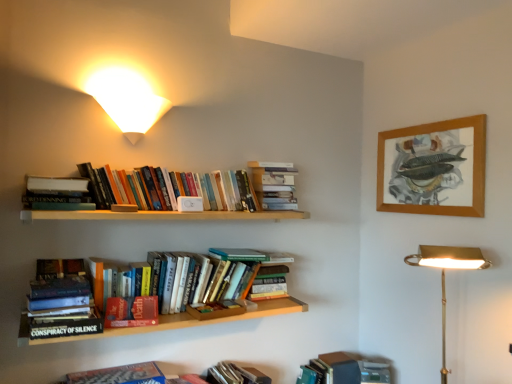
Find the location of a particular element. Image resolution: width=512 pixels, height=384 pixels. hardcover book at lower left, the fourth book when ordered from top to bottom is located at coordinates (62, 301).

Where is `wooden picture frame at upper right`? wooden picture frame at upper right is located at coordinates (434, 168).

Find the location of `hardcover book at lower right, placed as the 1th book when sorted from bottom to top`. hardcover book at lower right, placed as the 1th book when sorted from bottom to top is located at coordinates (343, 370).

Describe the element at coordinates (343, 370) in the screenshot. This screenshot has height=384, width=512. I see `hardcover book at lower right, the seventh book viewed from the top` at that location.

What are the coordinates of `hardcover book at lower left, the fourth book when ordered from top to bottom` in the screenshot? It's located at (62, 301).

How many degrees apart are the facing directions of hardcover book at center, the 6th book in the top-to-bottom sequence, and hardcover books at upper center, which is counted as the 6th book, starting from the bottom?

2.92 degrees separate the facing orientations of hardcover book at center, the 6th book in the top-to-bottom sequence, and hardcover books at upper center, which is counted as the 6th book, starting from the bottom.

Is hardcover book at center, the 6th book in the top-to-bottom sequence, at the left side of hardcover books at upper center, the second book in the top-to-bottom sequence?

Yes, hardcover book at center, the 6th book in the top-to-bottom sequence, is to the left of hardcover books at upper center, the second book in the top-to-bottom sequence.

Is hardcover book at center, the 6th book in the top-to-bottom sequence, thinner than hardcover books at upper center, which is counted as the 6th book, starting from the bottom?

No.

From the image's perspective, between hardcover book at center, which ranks as the second book in bottom-to-top order, and hardcover books at upper center, which is counted as the 6th book, starting from the bottom, who is located below?

hardcover book at center, which ranks as the second book in bottom-to-top order.

Who is taller, hardcover books at upper center, which is counted as the 6th book, starting from the bottom, or hardcover book at lower left, the fourth book when ordered from top to bottom?

Standing taller between the two is hardcover book at lower left, the fourth book when ordered from top to bottom.

Which object is thinner, hardcover books at upper center, which is counted as the 6th book, starting from the bottom, or hardcover book at lower left, positioned as the fourth book in bottom-to-top order?

With smaller width is hardcover books at upper center, which is counted as the 6th book, starting from the bottom.

Is hardcover books at upper center, which is counted as the 6th book, starting from the bottom, to the left or to the right of hardcover book at lower left, the fourth book when ordered from top to bottom, in the image?

hardcover books at upper center, which is counted as the 6th book, starting from the bottom, is positioned on hardcover book at lower left, the fourth book when ordered from top to bottom,'s right side.

The image size is (512, 384). I want to click on lamp above the gold brass desk lamp at lower right, the second lamp when ordered from top to bottom (from a real-world perspective), so click(x=126, y=99).

In the image, is gold brass desk lamp at lower right, the second lamp when ordered from top to bottom, positioned in front of or behind white matte wall sconce at upper left, the 1th lamp when ordered from left to right?

gold brass desk lamp at lower right, the second lamp when ordered from top to bottom, is in front of white matte wall sconce at upper left, the 1th lamp when ordered from left to right.

Considering the sizes of objects gold brass desk lamp at lower right, the second lamp when ordered from top to bottom, and white matte wall sconce at upper left, acting as the second lamp starting from the right, in the image provided, who is thinner, gold brass desk lamp at lower right, the second lamp when ordered from top to bottom, or white matte wall sconce at upper left, acting as the second lamp starting from the right,?

white matte wall sconce at upper left, acting as the second lamp starting from the right, is thinner.

Considering the relative sizes of hardcover book at upper left, the 5th book ordered from the bottom, and white matte wall sconce at upper left, which is the 1th lamp in top-to-bottom order, in the image provided, is hardcover book at upper left, the 5th book ordered from the bottom, smaller than white matte wall sconce at upper left, which is the 1th lamp in top-to-bottom order,?

Yes, hardcover book at upper left, the 5th book ordered from the bottom, is smaller than white matte wall sconce at upper left, which is the 1th lamp in top-to-bottom order.

What's the angular difference between hardcover book at upper left, which ranks as the third book in top-to-bottom order, and white matte wall sconce at upper left, acting as the second lamp starting from the right,'s facing directions?

There is a 0.422-degree angle between the facing directions of hardcover book at upper left, which ranks as the third book in top-to-bottom order, and white matte wall sconce at upper left, acting as the second lamp starting from the right.

Identify the location of lamp behind the hardcover book at upper left, which ranks as the third book in top-to-bottom order. The height and width of the screenshot is (384, 512). (126, 99).

Is the surface of hardcover book at upper left, the 5th book ordered from the bottom, in direct contact with white matte wall sconce at upper left, the second lamp ordered from the bottom?

No, hardcover book at upper left, the 5th book ordered from the bottom, is not beside white matte wall sconce at upper left, the second lamp ordered from the bottom.

Is hardcover book at upper left, the 5th book ordered from the bottom, bigger or smaller than white matte bookshelf at upper center, which is the first book from top to bottom?

Clearly, hardcover book at upper left, the 5th book ordered from the bottom, is smaller in size than white matte bookshelf at upper center, which is the first book from top to bottom.

From a real-world perspective, which object rests below the other?

In real-world perspective, hardcover book at upper left, the 5th book ordered from the bottom, is lower.

Is hardcover book at upper left, which ranks as the third book in top-to-bottom order, closer to the viewer compared to white matte bookshelf at upper center, which appears as the 7th book when ordered from the bottom?

That is True.

Is hardcover book at upper left, which ranks as the third book in top-to-bottom order, looking in the opposite direction of white matte bookshelf at upper center, which appears as the 7th book when ordered from the bottom?

hardcover book at upper left, which ranks as the third book in top-to-bottom order, is not turned away from white matte bookshelf at upper center, which appears as the 7th book when ordered from the bottom.

Is hardcover book at center, placed as the fifth book when sorted from top to bottom, facing towards white matte bookshelf at upper center, which is the first book from top to bottom?

No, hardcover book at center, placed as the fifth book when sorted from top to bottom, is not facing towards white matte bookshelf at upper center, which is the first book from top to bottom.

I want to click on book that is the 4th object located above the hardcover book at center, the third book ordered from the bottom (from the image's perspective), so click(x=274, y=184).

From the image's perspective, is hardcover book at center, the third book ordered from the bottom, positioned above or below white matte bookshelf at upper center, which is the first book from top to bottom?

Clearly, from the image's perspective, hardcover book at center, the third book ordered from the bottom, is below white matte bookshelf at upper center, which is the first book from top to bottom.

Measure the distance between hardcover book at center, placed as the fifth book when sorted from top to bottom, and white matte bookshelf at upper center, which appears as the 7th book when ordered from the bottom.

hardcover book at center, placed as the fifth book when sorted from top to bottom, and white matte bookshelf at upper center, which appears as the 7th book when ordered from the bottom, are 40.49 centimeters apart.

Does hardcover book at center, placed as the fifth book when sorted from top to bottom, have a greater width compared to wooden picture frame at upper right?

Indeed, hardcover book at center, placed as the fifth book when sorted from top to bottom, has a greater width compared to wooden picture frame at upper right.

Which point is more distant from viewer, (267,289) or (476,189)?

The point (267,289) is farther.

From the image's perspective, which one is positioned lower, hardcover book at center, placed as the fifth book when sorted from top to bottom, or wooden picture frame at upper right?

hardcover book at center, placed as the fifth book when sorted from top to bottom.

Based on the photo, is there a large distance between hardcover book at center, placed as the fifth book when sorted from top to bottom, and wooden picture frame at upper right?

hardcover book at center, placed as the fifth book when sorted from top to bottom, is near wooden picture frame at upper right, not far away.

Locate an element on the screen. Image resolution: width=512 pixels, height=384 pixels. the 4th book below the hardcover books at upper center, which is counted as the 6th book, starting from the bottom (from a real-world perspective) is located at coordinates (131, 311).

The image size is (512, 384). I want to click on the 2nd book above the hardcover book at lower left, the fourth book when ordered from top to bottom (from the image's perspective), so click(x=170, y=189).

When comparing their distances from hardcover books at upper center, the second book in the top-to-bottom sequence, does hardcover book at lower right, the seventh book viewed from the top, or hardcover book at upper left, the 5th book ordered from the bottom, seem closer?

Among the two, hardcover book at upper left, the 5th book ordered from the bottom, is located nearer to hardcover books at upper center, the second book in the top-to-bottom sequence.

Estimate the real-world distances between objects in this image. Which object is further from white matte bookshelf at upper center, which is the first book from top to bottom, hardcover book at lower left, the fourth book when ordered from top to bottom, or white matte wall sconce at upper left, which is the 1th lamp in top-to-bottom order?

hardcover book at lower left, the fourth book when ordered from top to bottom.

Based on their spatial positions, is gold brass desk lamp at lower right, acting as the 2th lamp starting from the left, or hardcover book at center, placed as the fifth book when sorted from top to bottom, closer to white matte wall sconce at upper left, acting as the second lamp starting from the right?

The object closer to white matte wall sconce at upper left, acting as the second lamp starting from the right, is hardcover book at center, placed as the fifth book when sorted from top to bottom.

Considering their positions, is hardcover book at center, which ranks as the second book in bottom-to-top order, positioned closer to gold brass desk lamp at lower right, the second lamp when ordered from top to bottom, than hardcover book at center, placed as the fifth book when sorted from top to bottom?

Among the two, hardcover book at center, placed as the fifth book when sorted from top to bottom, is located nearer to gold brass desk lamp at lower right, the second lamp when ordered from top to bottom.

When comparing their distances from hardcover book at center, the third book ordered from the bottom, does white matte wall sconce at upper left, the second lamp ordered from the bottom, or gold brass desk lamp at lower right, which is counted as the first lamp, starting from the right, seem closer?

gold brass desk lamp at lower right, which is counted as the first lamp, starting from the right.

Considering their positions, is hardcover book at center, the 6th book in the top-to-bottom sequence, positioned further to hardcover books at upper center, the second book in the top-to-bottom sequence, than gold brass desk lamp at lower right, acting as the 2th lamp starting from the left?

Among the two, gold brass desk lamp at lower right, acting as the 2th lamp starting from the left, is located further to hardcover books at upper center, the second book in the top-to-bottom sequence.

Estimate the real-world distances between objects in this image. Which object is further from hardcover book at upper left, the 5th book ordered from the bottom, gold brass desk lamp at lower right, acting as the first lamp starting from the bottom, or white matte wall sconce at upper left, acting as the second lamp starting from the right?

gold brass desk lamp at lower right, acting as the first lamp starting from the bottom, lies further to hardcover book at upper left, the 5th book ordered from the bottom, than the other object.

When comparing their distances from hardcover book at lower left, positioned as the fourth book in bottom-to-top order, does wooden picture frame at upper right or hardcover book at center, which ranks as the second book in bottom-to-top order, seem further?

wooden picture frame at upper right.

I want to click on lamp located between hardcover book at upper left, the 5th book ordered from the bottom, and gold brass desk lamp at lower right, which is counted as the first lamp, starting from the right, in the left-right direction, so click(x=126, y=99).

This screenshot has height=384, width=512. In order to click on lamp between hardcover book at lower left, positioned as the fourth book in bottom-to-top order, and gold brass desk lamp at lower right, acting as the 2th lamp starting from the left, in the horizontal direction in this screenshot , I will do `click(126, 99)`.

What are the coordinates of `lamp between white matte bookshelf at upper center, which appears as the 7th book when ordered from the bottom, and hardcover book at lower right, the seventh book viewed from the top, in the vertical direction` in the screenshot? It's located at (444, 275).

Where is `book situated between hardcover books at upper center, which is counted as the 6th book, starting from the bottom, and white matte bookshelf at upper center, which appears as the 7th book when ordered from the bottom, from left to right`? The width and height of the screenshot is (512, 384). book situated between hardcover books at upper center, which is counted as the 6th book, starting from the bottom, and white matte bookshelf at upper center, which appears as the 7th book when ordered from the bottom, from left to right is located at coordinates (269, 283).